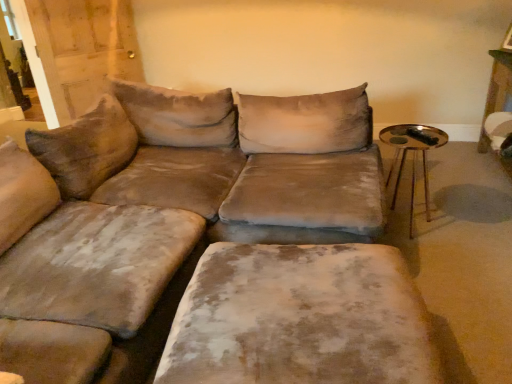
Question: Which is correct: velvet beige ottoman at center is inside velvet beige couch at center, or outside of it?

Choices:
 (A) inside
 (B) outside

Answer: (A)

Question: Is velvet beige ottoman at center taller or shorter than velvet beige couch at center?

Choices:
 (A) tall
 (B) short

Answer: (B)

Question: Considering the real-world distances, which object is closest to the gold metallic side table at right?

Choices:
 (A) velvet beige ottoman at center
 (B) velvet beige couch at center

Answer: (B)

Question: Which of these objects is positioned closest to the velvet beige couch at center?

Choices:
 (A) velvet beige ottoman at center
 (B) gold metallic side table at right

Answer: (A)